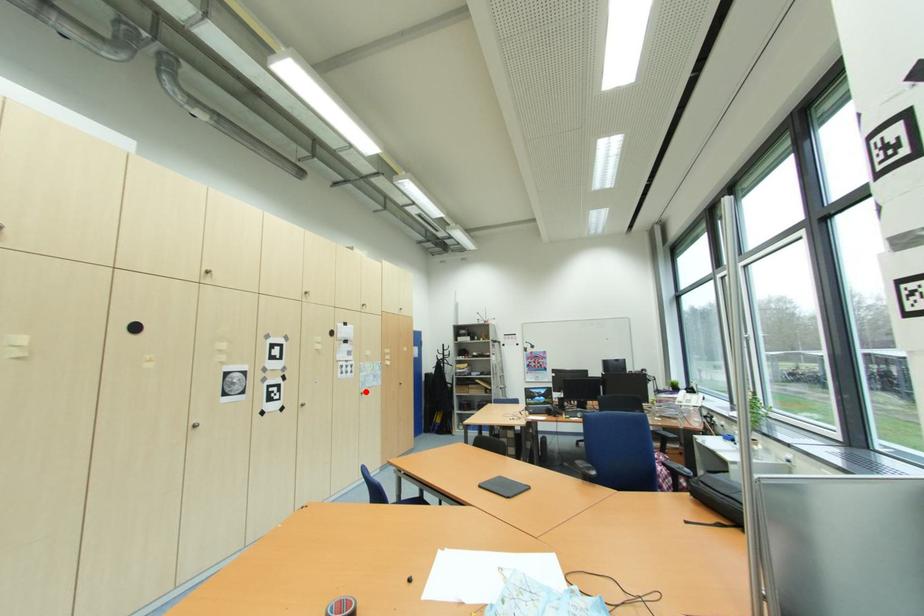
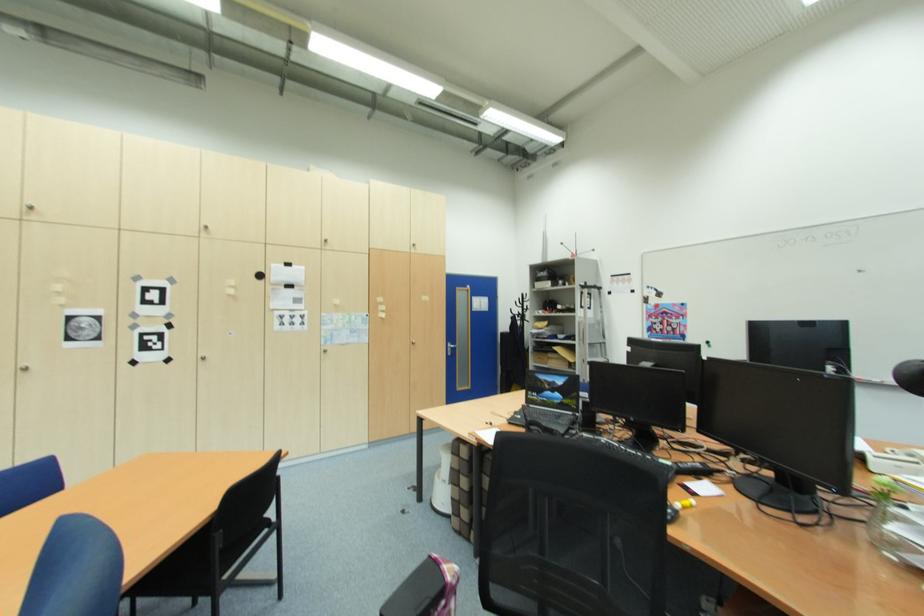
The point at the highlighted location is marked in the first image. Where is the corresponding point in the second image?

(327, 349)